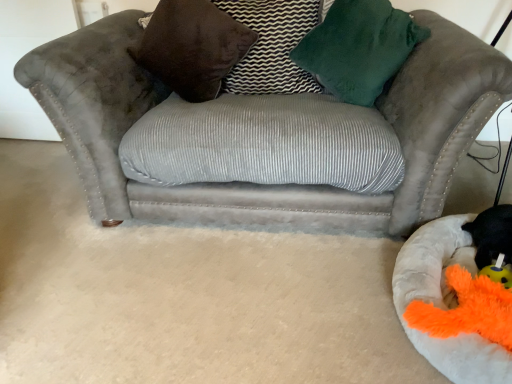
Question: Considering the relative positions of black plush toy at lower right and orange fuzzy toy at lower right in the image provided, is black plush toy at lower right behind orange fuzzy toy at lower right?

Choices:
 (A) yes
 (B) no

Answer: (A)

Question: Could you tell me if black plush toy at lower right is turned towards orange fuzzy toy at lower right?

Choices:
 (A) yes
 (B) no

Answer: (A)

Question: Can you confirm if black plush toy at lower right is thinner than orange fuzzy toy at lower right?

Choices:
 (A) yes
 (B) no

Answer: (A)

Question: Is black plush toy at lower right not within orange fuzzy toy at lower right?

Choices:
 (A) yes
 (B) no

Answer: (A)

Question: Are black plush toy at lower right and orange fuzzy toy at lower right far apart?

Choices:
 (A) no
 (B) yes

Answer: (A)

Question: Is black plush toy at lower right surrounding orange fuzzy toy at lower right?

Choices:
 (A) yes
 (B) no

Answer: (B)

Question: Does velvet brown pillow at center, which ranks as the second pillow in left-to-right order, have a lesser height compared to fluffy white dog bed at lower right?

Choices:
 (A) no
 (B) yes

Answer: (A)

Question: Is velvet brown pillow at center, acting as the 1th pillow starting from the right, placed right next to fluffy white dog bed at lower right?

Choices:
 (A) yes
 (B) no

Answer: (B)

Question: From a real-world perspective, is velvet brown pillow at center, which ranks as the second pillow in left-to-right order, on fluffy white dog bed at lower right?

Choices:
 (A) no
 (B) yes

Answer: (B)

Question: Considering the relative sizes of velvet brown pillow at center, which ranks as the second pillow in left-to-right order, and fluffy white dog bed at lower right in the image provided, is velvet brown pillow at center, which ranks as the second pillow in left-to-right order, wider than fluffy white dog bed at lower right?

Choices:
 (A) yes
 (B) no

Answer: (B)

Question: Considering the relative positions of velvet brown pillow at center, acting as the 1th pillow starting from the right, and fluffy white dog bed at lower right in the image provided, is velvet brown pillow at center, acting as the 1th pillow starting from the right, to the right of fluffy white dog bed at lower right from the viewer's perspective?

Choices:
 (A) yes
 (B) no

Answer: (B)

Question: Can you confirm if velvet brown pillow at center, which ranks as the second pillow in left-to-right order, is thinner than fluffy white dog bed at lower right?

Choices:
 (A) yes
 (B) no

Answer: (A)

Question: Does fluffy white dog bed at lower right appear on the left side of suede gray couch at center?

Choices:
 (A) yes
 (B) no

Answer: (B)